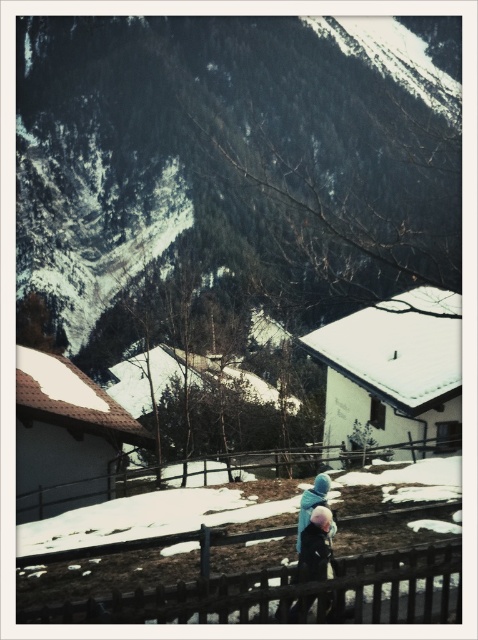
Can you confirm if brown wooden fence at lower center is taller than dark blue fabric coat at center?

Indeed, brown wooden fence at lower center has a greater height compared to dark blue fabric coat at center.

Identify the location of brown wooden fence at lower center. (290, 593).

Who is taller, wooden at lower center or dark blue fabric coat at center?

With more height is wooden at lower center.

Is point (408, 464) farther from viewer compared to point (327, 564)?

Yes, it is behind point (327, 564).

Is point (412, 500) positioned in front of point (317, 508)?

That is False.

I want to click on wooden at lower center, so click(173, 502).

Does snowy forested mountain at upper center have a greater height compared to brown wooden fence at lower center?

Correct, snowy forested mountain at upper center is much taller as brown wooden fence at lower center.

Is point (402, 225) farther from camera compared to point (339, 596)?

That is True.

Find the location of a particular element. This screenshot has height=640, width=478. snowy forested mountain at upper center is located at coordinates (238, 154).